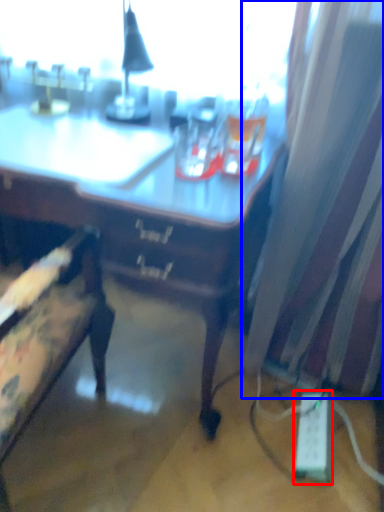
Question: Which of the following is the farthest to the observer, extension cord (highlighted by a red box) or curtain (highlighted by a blue box)?

Choices:
 (A) extension cord
 (B) curtain

Answer: (A)